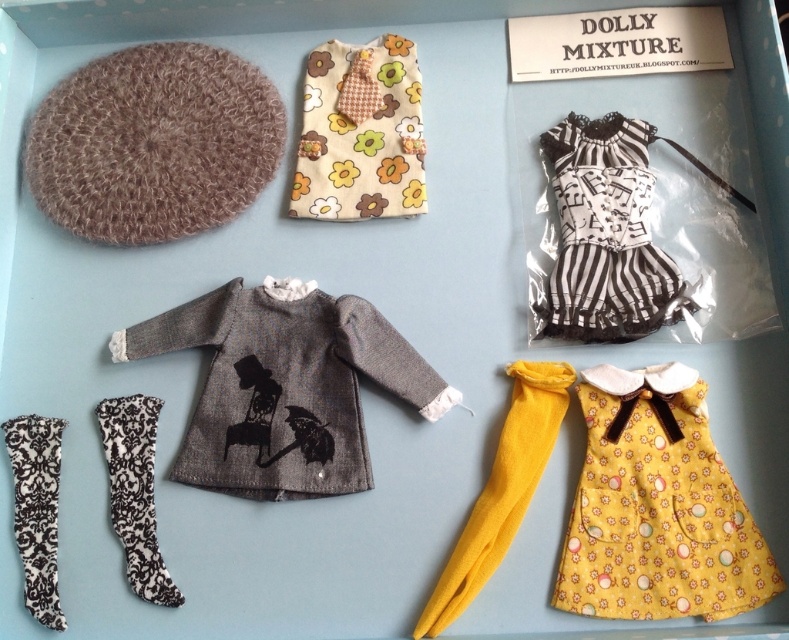
Question: Is knitted gray sweater at center to the left of black damask socks at lower left from the viewer's perspective?

Choices:
 (A) no
 (B) yes

Answer: (A)

Question: Which of the following is the farthest from the observer?

Choices:
 (A) (21, 477)
 (B) (251, 497)
 (C) (312, 198)
 (D) (601, 120)

Answer: (C)

Question: Can you confirm if yellow fabric dress at lower right is positioned to the left of floral fabric dress at upper center?

Choices:
 (A) yes
 (B) no

Answer: (B)

Question: Does knitted gray sweater at center appear on the left side of black damask socks at lower left?

Choices:
 (A) yes
 (B) no

Answer: (B)

Question: Which point is farther to the camera?

Choices:
 (A) click(354, 124)
 (B) click(234, 337)
 (C) click(574, 157)

Answer: (A)

Question: Among these points, which one is nearest to the camera?

Choices:
 (A) (586, 609)
 (B) (32, 577)
 (C) (335, 474)

Answer: (A)